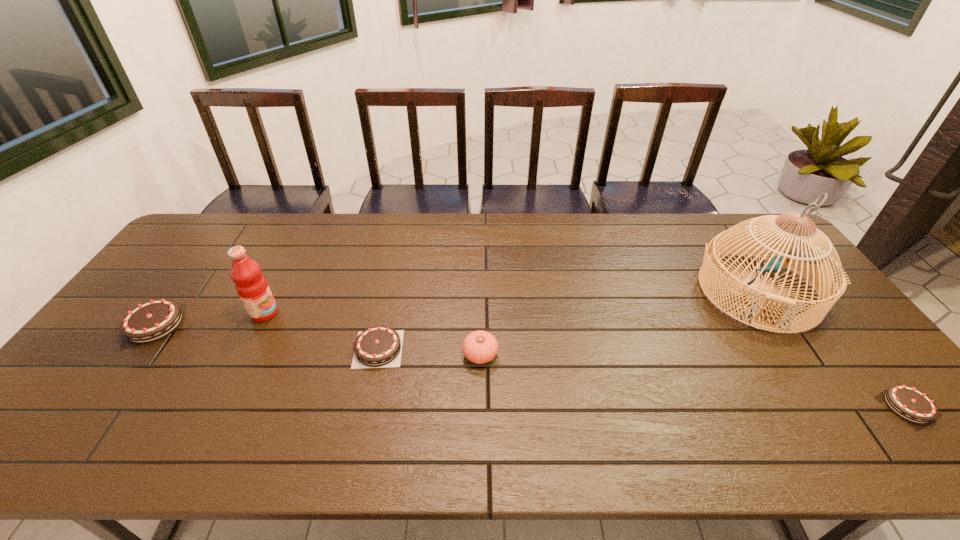
I want to click on vacant region between the fourth object from right to left and the nearest chocolate cake, so click(643, 377).

The width and height of the screenshot is (960, 540). I want to click on vacant space that is in between the second chocolate cake from right to left and the tallest object, so click(x=568, y=320).

Where is `vacant area that lies between the third object from left to right and the fourth object from left to right`? vacant area that lies between the third object from left to right and the fourth object from left to right is located at coordinates (429, 352).

You are a GUI agent. You are given a task and a screenshot of the screen. Output one action in this format:
    pyautogui.click(x=<x>, y=<y>)
    Task: Click on the vacant space that's between the third tallest object and the fifth tallest object
    
    Given the screenshot: What is the action you would take?
    pyautogui.click(x=429, y=352)

Identify the location of vacant point located between the tallest chocolate cake and the fifth object from right to left. This screenshot has height=540, width=960. (209, 319).

Find the location of `free space between the tallest object and the leftmost chocolate cake`. free space between the tallest object and the leftmost chocolate cake is located at coordinates (457, 308).

Image resolution: width=960 pixels, height=540 pixels. What are the coordinates of `the fifth closest object to the fourth shortest object` in the screenshot? It's located at (x=909, y=403).

Choose which object is the fifth nearest neighbor to the fourth shortest object. Please provide its 2D coordinates. Your answer should be formatted as a tuple, i.e. [(x, y)], where the tuple contains the x and y coordinates of a point satisfying the conditions above.

[(909, 403)]

The width and height of the screenshot is (960, 540). What are the coordinates of `chocolate cake that is the closest to the tallest object` in the screenshot? It's located at (909, 403).

Locate an element on the screen. The width and height of the screenshot is (960, 540). chocolate cake that stands as the closest to the second object from left to right is located at coordinates (151, 321).